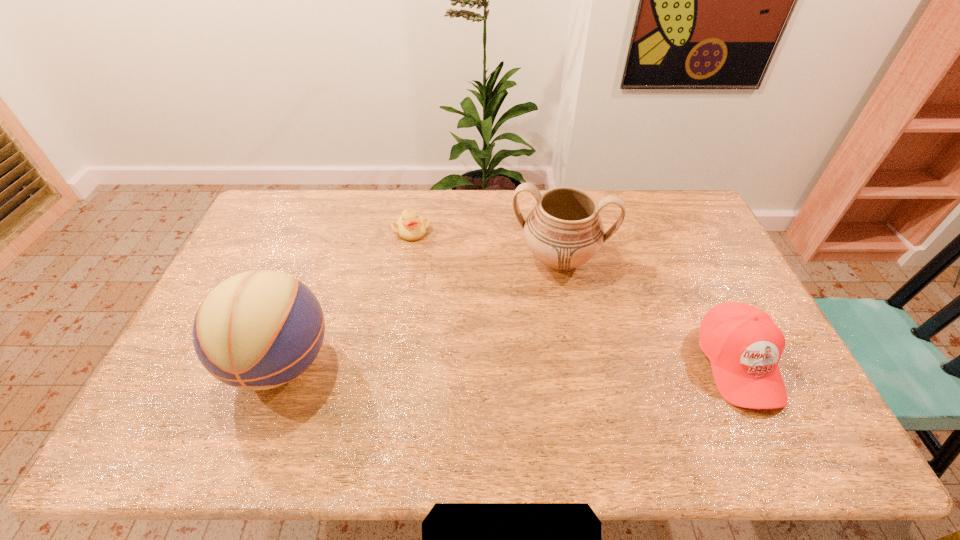
At what (x,y) coordinates should I click in order to perform the action: click on basketball. Please return your answer as a coordinate pair (x, y). Looking at the image, I should click on (257, 330).

Identify the location of the second shortest object. The image size is (960, 540). (743, 344).

The width and height of the screenshot is (960, 540). In order to click on the rightmost object in this screenshot , I will do `click(743, 344)`.

At what (x,y) coordinates should I click in order to perform the action: click on the second object from right to left. Please return your answer as a coordinate pair (x, y). The height and width of the screenshot is (540, 960). Looking at the image, I should click on (564, 230).

In order to click on the shortest object in this screenshot , I will do `click(410, 226)`.

At what (x,y) coordinates should I click in order to perform the action: click on duckling. Please return your answer as a coordinate pair (x, y). The height and width of the screenshot is (540, 960). Looking at the image, I should click on (410, 226).

Where is `free region located 0.380m on the front-facing side of the urn`? free region located 0.380m on the front-facing side of the urn is located at coordinates (531, 392).

You are a GUI agent. You are given a task and a screenshot of the screen. Output one action in this format:
    pyautogui.click(x=<x>, y=<y>)
    Task: Click on the free spot located 0.300m on the front-facing side of the urn
    
    Given the screenshot: What is the action you would take?
    pyautogui.click(x=536, y=366)

The width and height of the screenshot is (960, 540). I want to click on vacant space located 0.060m on the front-facing side of the urn, so click(x=548, y=300).

Where is `vacant area situated 0.380m at the face of the duckling`? The width and height of the screenshot is (960, 540). vacant area situated 0.380m at the face of the duckling is located at coordinates (482, 312).